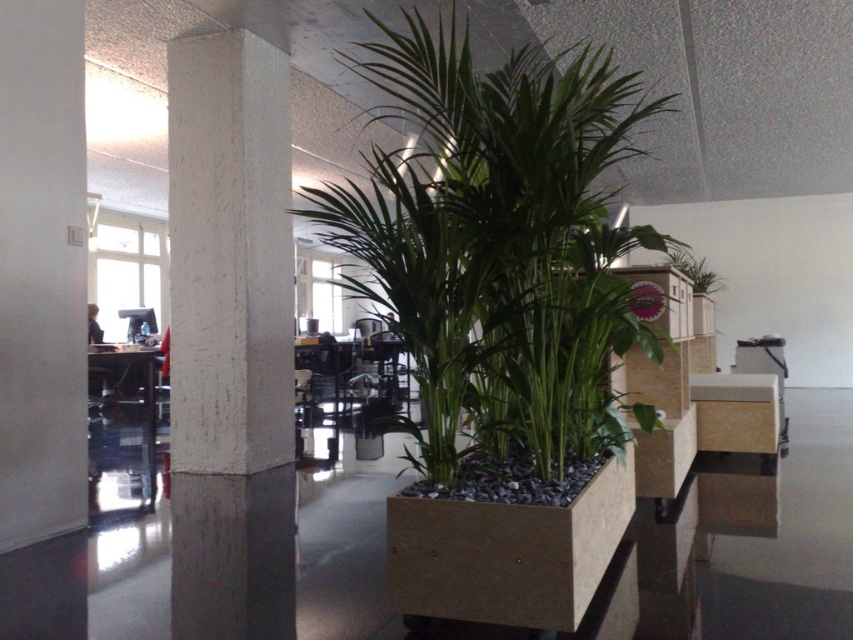
Question: Observing the image, what is the correct spatial positioning of white textured pillar at center in reference to green leafy plant at upper center?

Choices:
 (A) below
 (B) above

Answer: (A)

Question: Does white textured pillar at center have a smaller size compared to green leafy plant at upper center?

Choices:
 (A) yes
 (B) no

Answer: (B)

Question: Can you confirm if white textured pillar at center is positioned to the left of green leafy plant at upper center?

Choices:
 (A) yes
 (B) no

Answer: (A)

Question: Which object appears farthest from the camera in this image?

Choices:
 (A) green leafy plant at upper center
 (B) white textured pillar at center

Answer: (A)